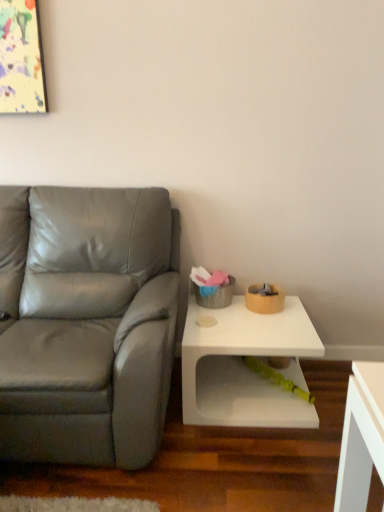
I want to click on free location in front of white matte table at lower right, so click(240, 463).